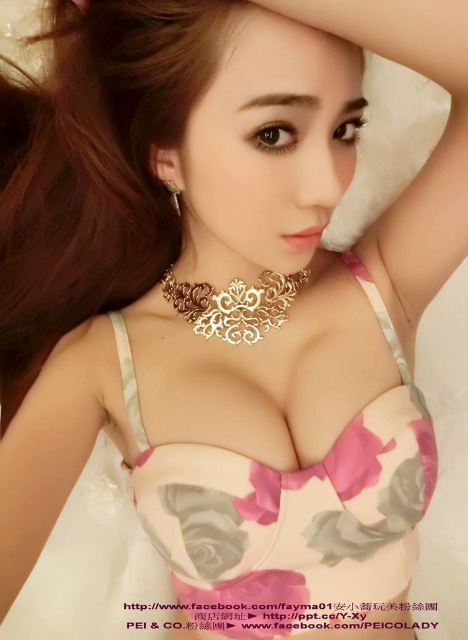
Question: Is pink floral fabric bikini top at center below gold metallic necklace at center?

Choices:
 (A) no
 (B) yes

Answer: (B)

Question: Is pink floral fabric bikini top at center smaller than gold metallic necklace at center?

Choices:
 (A) no
 (B) yes

Answer: (A)

Question: Which of the following is the closest to the observer?

Choices:
 (A) [284, 280]
 (B) [239, 515]

Answer: (B)

Question: Is pink floral fabric bikini top at center bigger than gold metallic necklace at center?

Choices:
 (A) yes
 (B) no

Answer: (A)

Question: Which object appears farthest from the camera in this image?

Choices:
 (A) pink floral fabric bikini top at center
 (B) gold metallic necklace at center

Answer: (B)

Question: Which point is closer to the camera?

Choices:
 (A) (285, 280)
 (B) (262, 509)

Answer: (B)